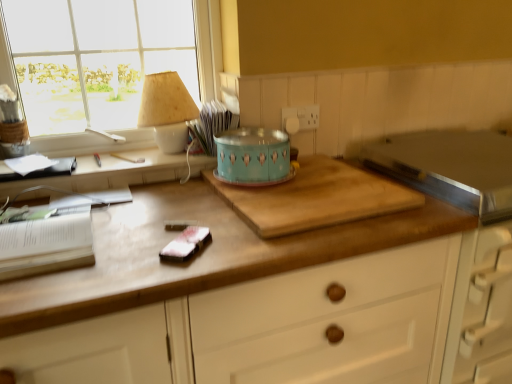
Image resolution: width=512 pixels, height=384 pixels. I want to click on free spot behind satin pink fabric at center, so [x=189, y=216].